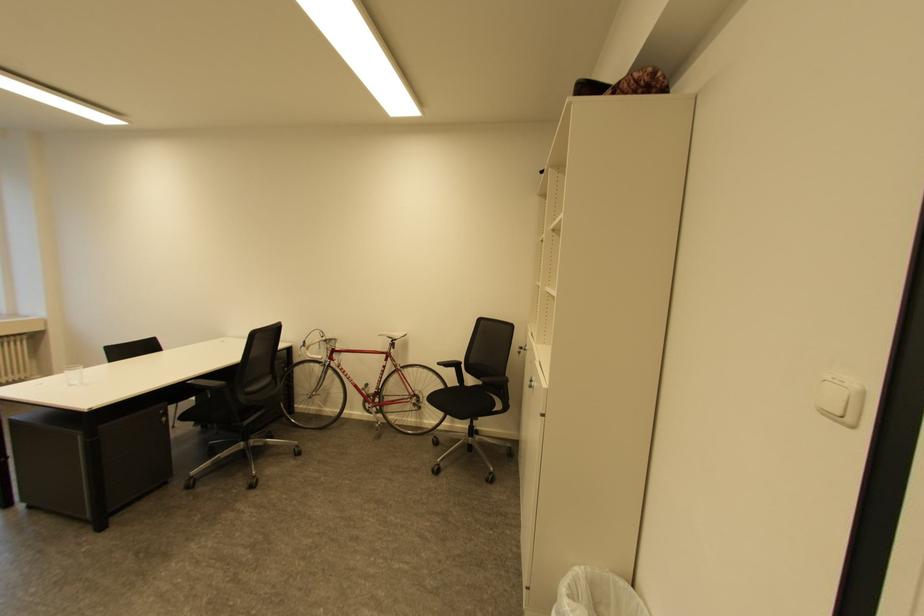
Image resolution: width=924 pixels, height=616 pixels. I want to click on white trash can, so click(x=596, y=594).